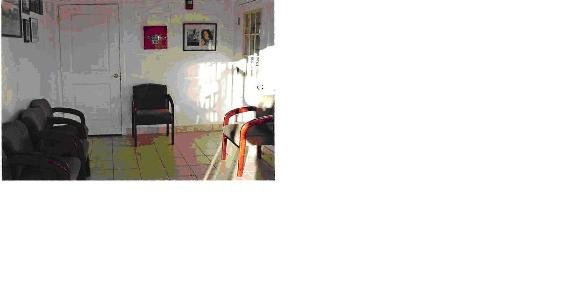
The image size is (576, 294). I want to click on black photo frame, so click(x=190, y=24).